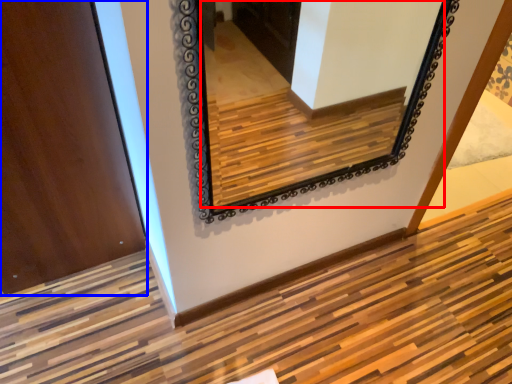
Question: Which of the following is the farthest to the observer, mirror (highlighted by a red box) or door (highlighted by a blue box)?

Choices:
 (A) mirror
 (B) door

Answer: (B)